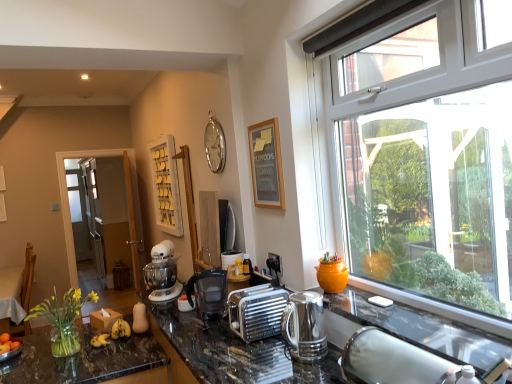
Where is `vacant region in front of silver metallic toaster at center, the first appliance positioned from the front`? This screenshot has width=512, height=384. vacant region in front of silver metallic toaster at center, the first appliance positioned from the front is located at coordinates (257, 351).